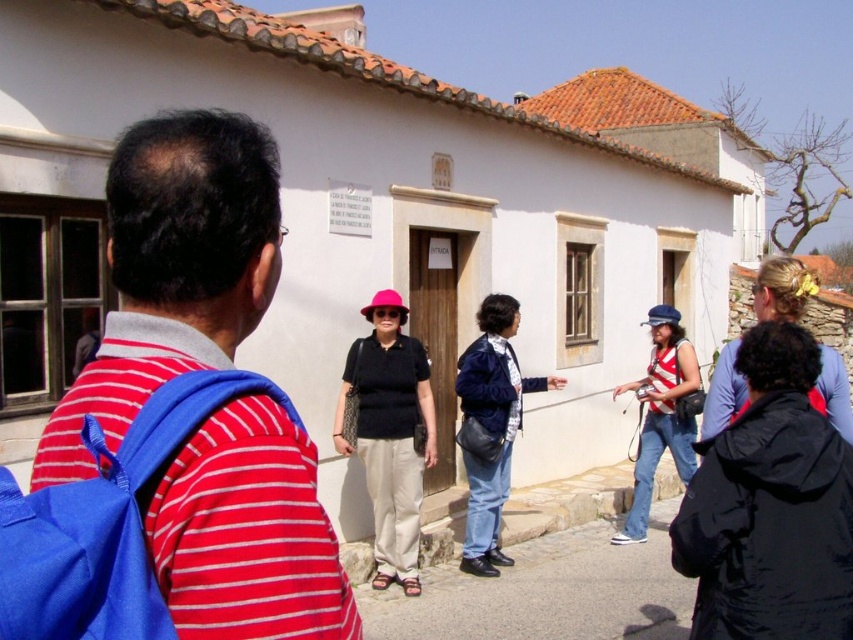
Question: Which is nearer to the denim jacket at center?

Choices:
 (A) black hair at upper right
 (B) striped fabric tank top at center

Answer: (B)

Question: Does pink matte hat at center appear on the left side of striped fabric tank top at center?

Choices:
 (A) no
 (B) yes

Answer: (B)

Question: Is denim jacket at center smaller than striped fabric tank top at center?

Choices:
 (A) yes
 (B) no

Answer: (A)

Question: Which point is closer to the camera?

Choices:
 (A) (505, 365)
 (B) (47, 452)
 (C) (618, 387)

Answer: (B)

Question: Which point is farther to the camera?

Choices:
 (A) (793, 284)
 (B) (276, 262)
 (C) (363, 387)

Answer: (C)

Question: Can you confirm if pink matte hat at center is positioned above striped fabric tank top at center?

Choices:
 (A) yes
 (B) no

Answer: (A)